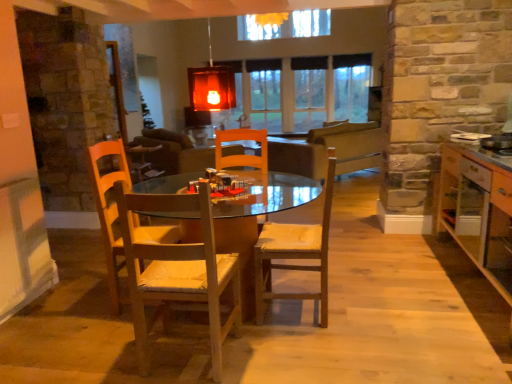
Question: From a real-world perspective, does wooden table at center stand above matte glass lampshade at upper center?

Choices:
 (A) no
 (B) yes

Answer: (A)

Question: From the image's perspective, is wooden table at center below matte glass lampshade at upper center?

Choices:
 (A) no
 (B) yes

Answer: (B)

Question: Considering the relative positions of wooden table at center and matte glass lampshade at upper center in the image provided, is wooden table at center in front of matte glass lampshade at upper center?

Choices:
 (A) no
 (B) yes

Answer: (B)

Question: From a real-world perspective, is wooden table at center located beneath matte glass lampshade at upper center?

Choices:
 (A) no
 (B) yes

Answer: (B)

Question: Does wooden table at center lie behind matte glass lampshade at upper center?

Choices:
 (A) no
 (B) yes

Answer: (A)

Question: Can matte glass lampshade at upper center be found inside wooden table at center?

Choices:
 (A) no
 (B) yes

Answer: (A)

Question: From the image's perspective, is wooden cabinet at right under clear glass window at center?

Choices:
 (A) yes
 (B) no

Answer: (A)

Question: Is wooden cabinet at right facing towards clear glass window at center?

Choices:
 (A) no
 (B) yes

Answer: (A)

Question: Can you confirm if wooden cabinet at right is wider than clear glass window at center?

Choices:
 (A) no
 (B) yes

Answer: (B)

Question: Is clear glass window at center a part of wooden cabinet at right?

Choices:
 (A) yes
 (B) no

Answer: (B)

Question: Can you confirm if wooden cabinet at right is bigger than clear glass window at center?

Choices:
 (A) yes
 (B) no

Answer: (A)

Question: Is wooden cabinet at right closer to the viewer compared to clear glass window at center?

Choices:
 (A) yes
 (B) no

Answer: (A)

Question: Is wooden table at center positioned behind clear glass window at center?

Choices:
 (A) no
 (B) yes

Answer: (A)